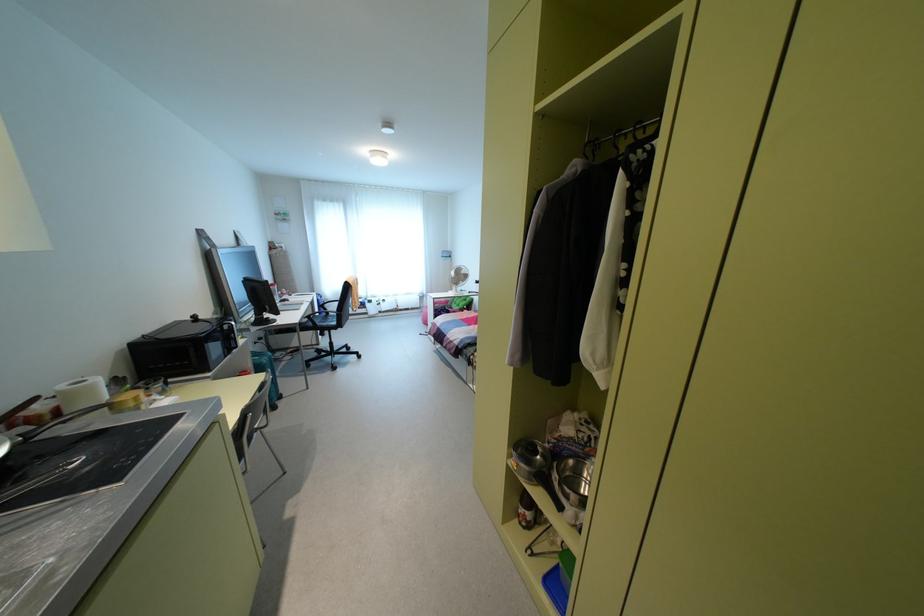
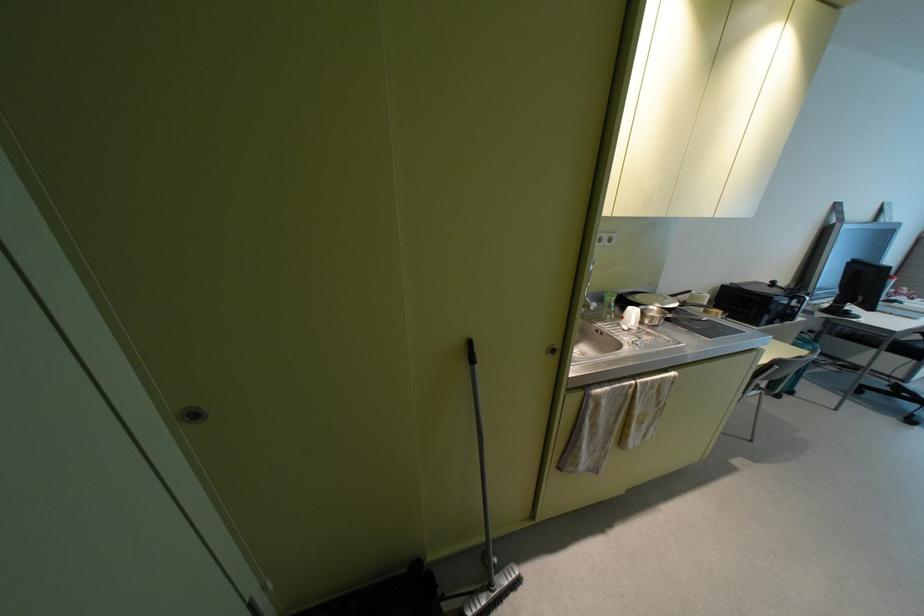
How did the camera likely rotate?

The rotation direction of the camera is left-down.